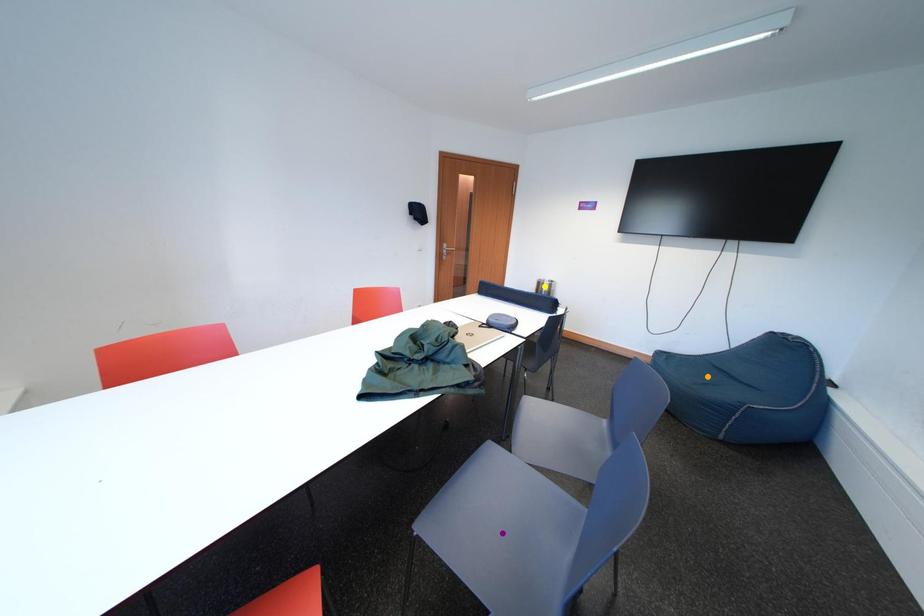
Consider the image. Order these from nearest to farthest:
yellow point
purple point
orange point

purple point < orange point < yellow point